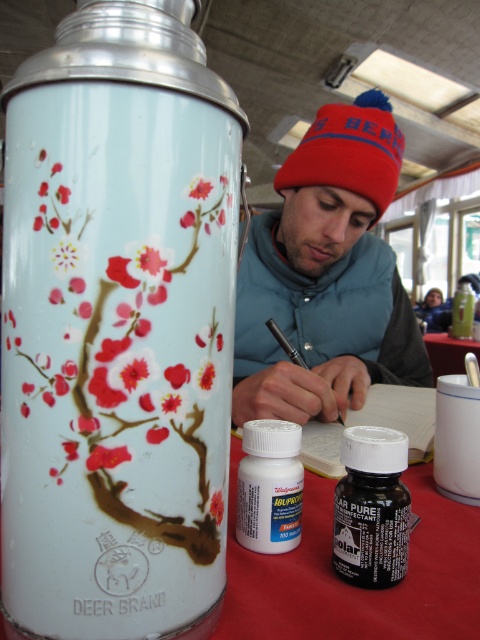
Question: Is matte blue beanie at center to the left of white plastic bottle at center from the viewer's perspective?

Choices:
 (A) no
 (B) yes

Answer: (A)

Question: Which is farther from the smooth white table at center?

Choices:
 (A) translucent plastic bottle at center
 (B) white plastic bottle at center

Answer: (B)

Question: Is black matte bottle at lower center wider than white plastic bottle at center?

Choices:
 (A) no
 (B) yes

Answer: (A)

Question: Which object is the closest to the smooth white table at center?

Choices:
 (A) black matte bottle at lower center
 (B) white plastic bottle at center
 (C) matte blue beanie at center

Answer: (C)

Question: From the image, what is the correct spatial relationship of black matte bottle at lower center in relation to translucent plastic bottle at center?

Choices:
 (A) above
 (B) below

Answer: (B)

Question: Which object appears closest to the camera in this image?

Choices:
 (A) translucent plastic bottle at center
 (B) black matte bottle at lower center
 (C) white plastic bottle at center

Answer: (B)